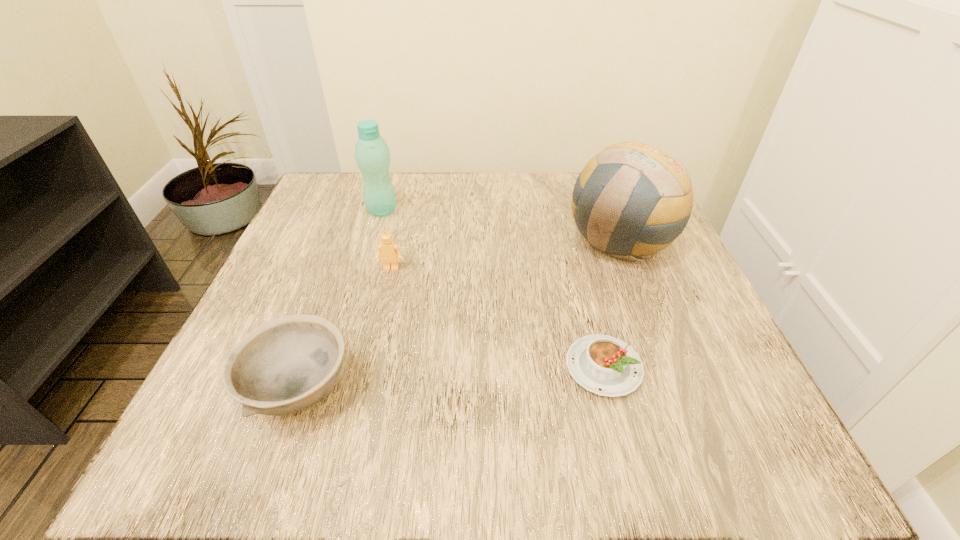
Locate an element on the screen. The height and width of the screenshot is (540, 960). vacant space at the far edge of the desktop is located at coordinates (410, 193).

Locate an element on the screen. vacant space at the left edge is located at coordinates pos(330,268).

I want to click on blank area at the right edge, so click(x=672, y=339).

In the image, there is a desktop. Identify the location of blank space at the far left corner. This screenshot has width=960, height=540. (330, 201).

What are the coordinates of `vacant space at the near right corner of the desktop` in the screenshot? It's located at (710, 438).

Find the location of a particular element. The image size is (960, 540). vacant space in between the shortest object and the bowl is located at coordinates click(451, 378).

Locate an element on the screen. empty space that is in between the bowl and the Lego is located at coordinates (346, 329).

Find the location of a particular element. free point between the bowl and the volleyball is located at coordinates coord(460,315).

Where is `free area in between the bottle and the pudding`? The height and width of the screenshot is (540, 960). free area in between the bottle and the pudding is located at coordinates (492, 289).

Image resolution: width=960 pixels, height=540 pixels. What are the coordinates of `free spot between the bowl and the pudding` in the screenshot? It's located at (451, 378).